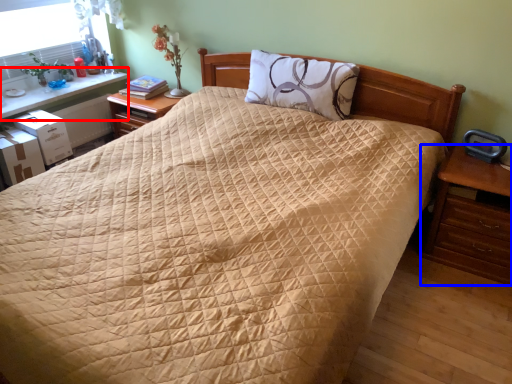
Question: Which of the following is the farthest to the observer, table (highlighted by a red box) or nightstand (highlighted by a blue box)?

Choices:
 (A) table
 (B) nightstand

Answer: (A)